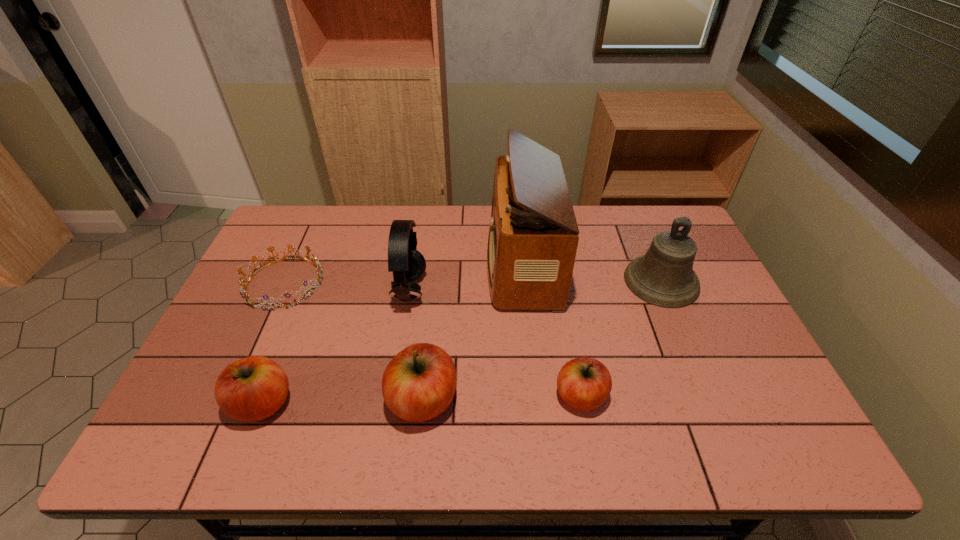
The height and width of the screenshot is (540, 960). In order to click on the leftmost apple in this screenshot , I will do `click(253, 388)`.

The height and width of the screenshot is (540, 960). Find the location of `the fifth tallest object`. the fifth tallest object is located at coordinates (253, 388).

This screenshot has height=540, width=960. I want to click on the second apple from left to right, so click(x=419, y=383).

You are a GUI agent. You are given a task and a screenshot of the screen. Output one action in this format:
    pyautogui.click(x=<x>, y=<y>)
    Task: Click on the sixth tallest object
    The image size is (960, 540).
    Given the screenshot: What is the action you would take?
    pyautogui.click(x=584, y=383)

You are a GUI agent. You are given a task and a screenshot of the screen. Output one action in this format:
    pyautogui.click(x=<x>, y=<y>)
    Task: Click on the shortest apple
    The height and width of the screenshot is (540, 960).
    Given the screenshot: What is the action you would take?
    pyautogui.click(x=584, y=383)

Identify the location of radio receiver. The width and height of the screenshot is (960, 540). (533, 237).

Identify the location of earphone. (407, 264).

Find the location of a particular element. Image resolution: width=960 pixels, height=540 pixels. tiara is located at coordinates (315, 262).

At what (x,y) coordinates should I click in order to perform the action: click on the rightmost object. Please return your answer as a coordinate pair (x, y). Looking at the image, I should click on (664, 276).

This screenshot has height=540, width=960. What are the coordinates of `free location located 0.160m on the back of the second tallest apple` in the screenshot? It's located at pos(293,328).